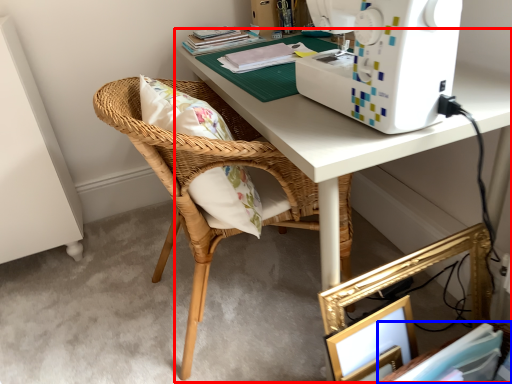
Question: Which point is closer to the camera, desk (highlighted by a red box) or book (highlighted by a blue box)?

Choices:
 (A) desk
 (B) book

Answer: (A)